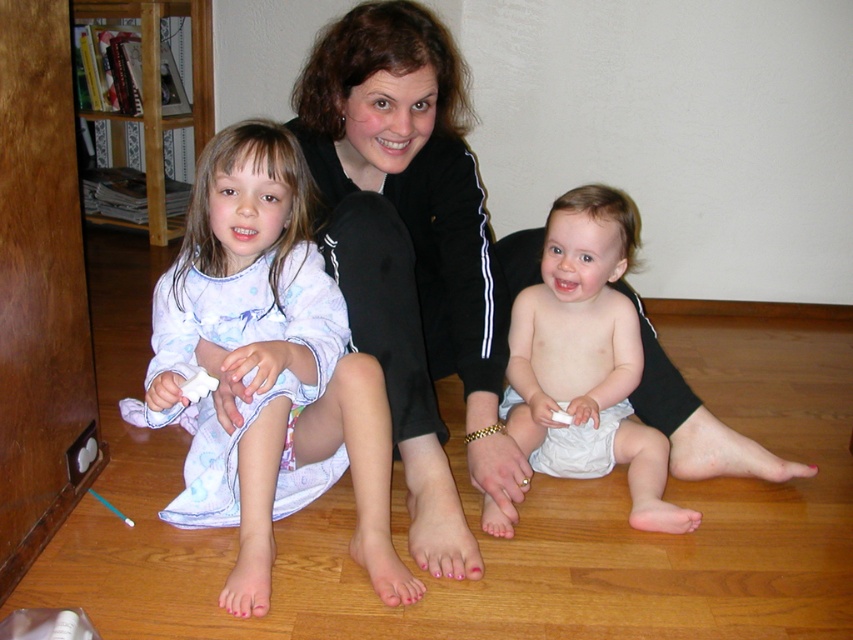
Is point (410, 179) less distant than point (149, 164)?

That is True.

Who is more distant from viewer, (354, 150) or (80, 12)?

The point (80, 12) is more distant.

Identify the location of black smooth tracksuit at center. Image resolution: width=853 pixels, height=640 pixels. (415, 252).

From the picture: Which is below, light blue cotton pajamas at left or wooden bookshelf at left?

Positioned lower is light blue cotton pajamas at left.

Can you confirm if light blue cotton pajamas at left is smaller than wooden bookshelf at left?

Indeed, light blue cotton pajamas at left has a smaller size compared to wooden bookshelf at left.

Is point (245, 579) positioned before point (209, 19)?

Yes, point (245, 579) is closer to viewer.

In order to click on light blue cotton pajamas at left in this screenshot , I will do `click(270, 368)`.

This screenshot has width=853, height=640. What do you see at coordinates (585, 356) in the screenshot?
I see `white diaper at center` at bounding box center [585, 356].

Is point (537, 372) positioned after point (605, 451)?

That is True.

This screenshot has height=640, width=853. I want to click on white diaper at center, so click(x=585, y=356).